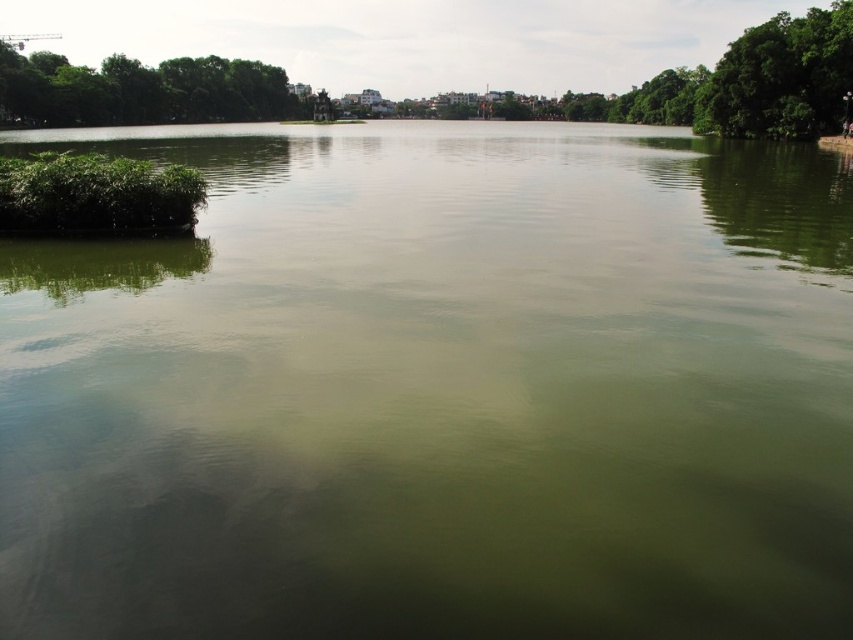
What do you see at coordinates (144, 90) in the screenshot? This screenshot has height=640, width=853. I see `green leafy tree at left` at bounding box center [144, 90].

Does green leafy tree at left appear under green leafy algae at left?

Incorrect, green leafy tree at left is not positioned below green leafy algae at left.

Describe the element at coordinates (144, 90) in the screenshot. I see `green leafy tree at left` at that location.

The image size is (853, 640). I want to click on green leafy tree at left, so click(x=144, y=90).